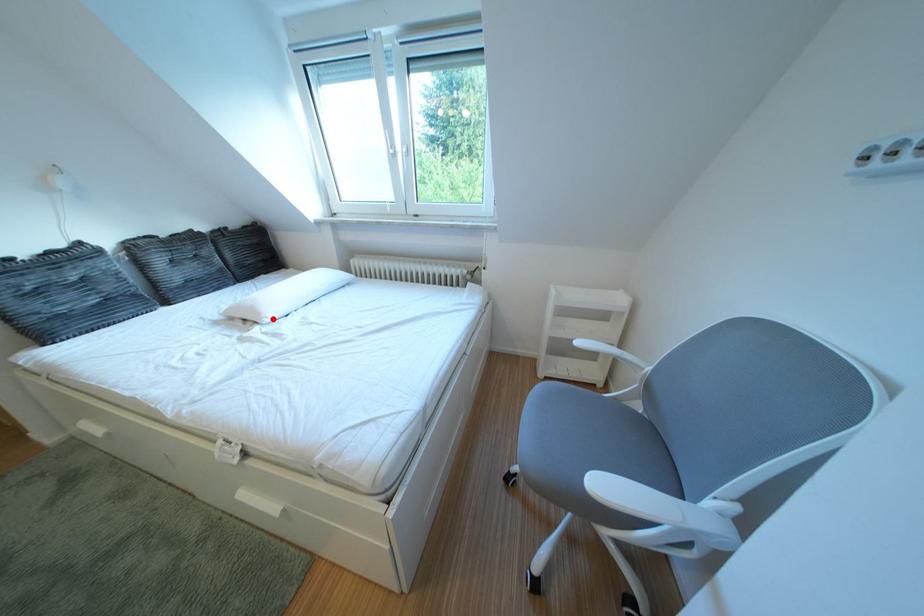
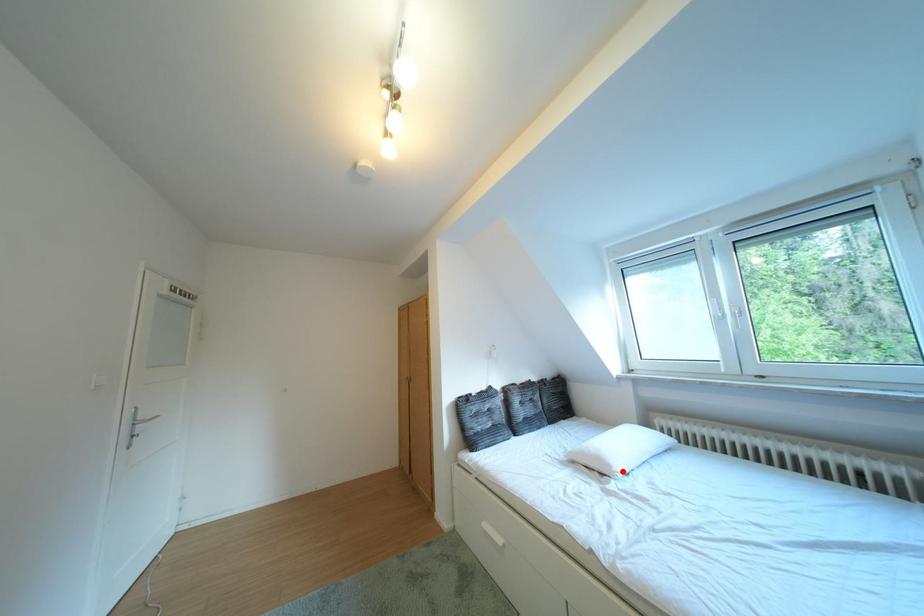
I am providing you with two images of the same scene from different viewpoints. A red point is marked on the first image and another point is marked on the second image. Is the marked point in image1 the same physical position as the marked point in image2?

Yes